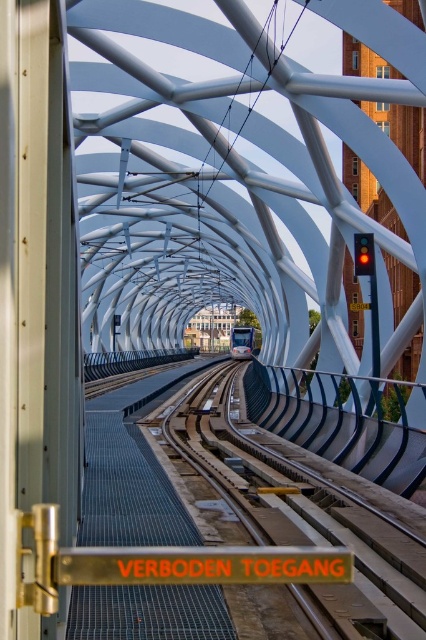
Question: Can you confirm if metallic smooth train track at center is positioned above matte blue train at center?

Choices:
 (A) no
 (B) yes

Answer: (A)

Question: Which of the following is the closest to the observer?

Choices:
 (A) (258, 332)
 (B) (307, 611)

Answer: (B)

Question: Does metallic smooth train track at center have a larger size compared to matte blue train at center?

Choices:
 (A) no
 (B) yes

Answer: (A)

Question: Is the position of metallic smooth train track at center more distant than that of matte blue train at center?

Choices:
 (A) yes
 (B) no

Answer: (B)